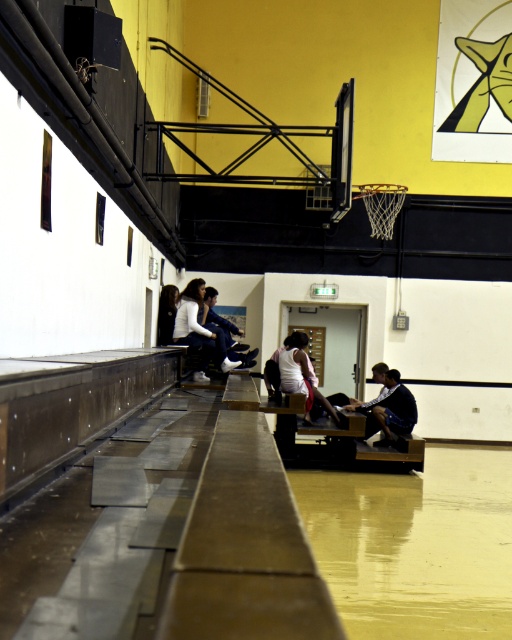
Question: Which object is closer to the camera taking this photo?

Choices:
 (A) white matte tank top at center
 (B) dark blue jersey at center
 (C) dark blue jeans at center
 (D) dark blue uniform at center

Answer: (C)

Question: Where is dark blue uniform at center located in relation to dark blue jersey at center in the image?

Choices:
 (A) right
 (B) left

Answer: (B)

Question: Is dark blue jersey at center behind dark blue jeans at center?

Choices:
 (A) yes
 (B) no

Answer: (A)

Question: Which of the following is the farthest from the observer?

Choices:
 (A) white fabric jacket at center
 (B) dark blue jeans at center
 (C) dark blue jersey at center

Answer: (C)

Question: Can you confirm if white matte tank top at center is wider than dark blue jeans at center?

Choices:
 (A) no
 (B) yes

Answer: (B)

Question: Among these objects, which one is nearest to the camera?

Choices:
 (A) dark blue jersey at center
 (B) dark blue uniform at center
 (C) white matte tank top at center

Answer: (B)